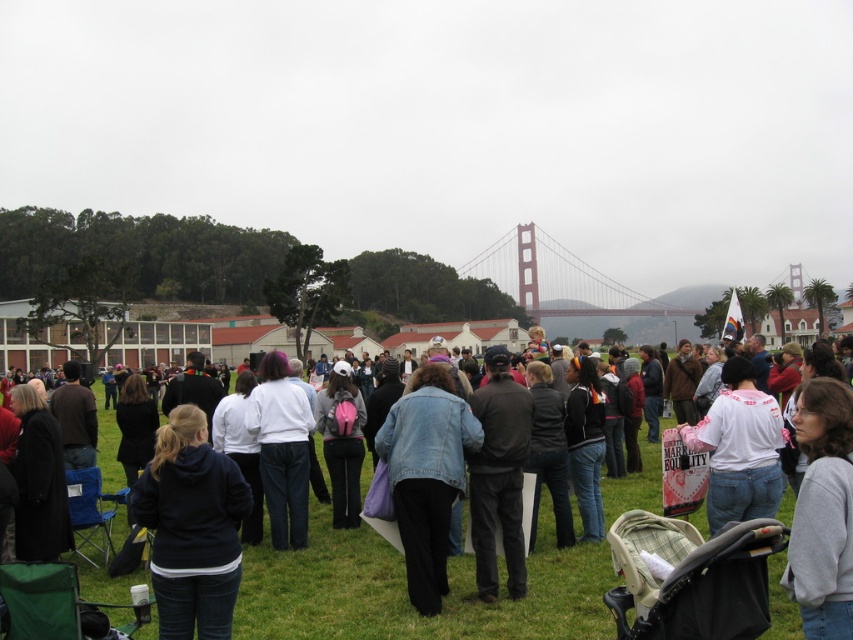
Which is in front, point (543, 490) or point (297, 500)?

Point (297, 500) is in front.

This screenshot has width=853, height=640. In order to click on green grass at center in this screenshot , I will do `click(405, 593)`.

Which is more to the right, black fleece jacket at lower left or white matte shirt at center?

From the viewer's perspective, white matte shirt at center appears more on the right side.

Between point (225, 515) and point (711, 435), which one is positioned in front?

Point (225, 515) is in front.

Where is `black fleece jacket at lower left`? This screenshot has width=853, height=640. black fleece jacket at lower left is located at coordinates (190, 528).

Between green grass at center and white matte shirt at center, which one is positioned higher?

white matte shirt at center is higher up.

Measure the distance between green grass at center and camera.

The distance of green grass at center from camera is 29.09 meters.

The image size is (853, 640). In order to click on green grass at center in this screenshot , I will do `click(405, 593)`.

Identify the location of green grass at center. The width and height of the screenshot is (853, 640). (405, 593).